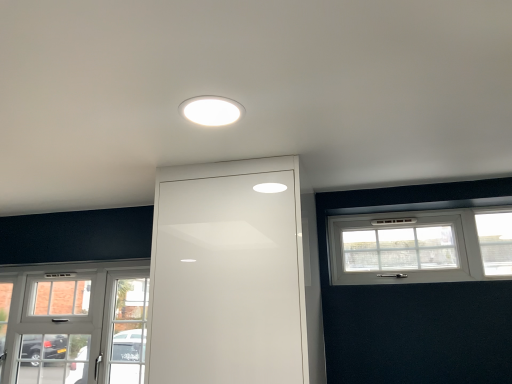
This screenshot has width=512, height=384. I want to click on white glass door at lower left, which is counted as the 1th window, starting from the back, so click(x=74, y=323).

What do you see at coordinates (421, 246) in the screenshot? I see `white textured window at upper right, marked as the 2th window in a left-to-right arrangement` at bounding box center [421, 246].

What do you see at coordinates (228, 275) in the screenshot? I see `white glossy door at center` at bounding box center [228, 275].

In order to face white glossy door at center, should I rotate leftwards or rightwards?

Turn left by 1.348 degrees to look at white glossy door at center.

The height and width of the screenshot is (384, 512). Find the location of `white glass door at lower left, which is counted as the 1th window, starting from the back`. white glass door at lower left, which is counted as the 1th window, starting from the back is located at coordinates (74, 323).

Would you say white glass door at lower left, placed as the first window when sorted from left to right, contains white glossy light fixture at center?

No, white glossy light fixture at center is not surrounded by white glass door at lower left, placed as the first window when sorted from left to right.

Consider the image. Is white glass door at lower left, which is counted as the 1th window, starting from the back, facing towards white glossy light fixture at center?

No, white glass door at lower left, which is counted as the 1th window, starting from the back, is not aimed at white glossy light fixture at center.

From a real-world perspective, is white glass door at lower left, acting as the 2th window starting from the front, physically located above or below white glossy light fixture at center?

In terms of real-world spatial position, white glass door at lower left, acting as the 2th window starting from the front, is below white glossy light fixture at center.

From their relative heights in the image, would you say white glossy door at center is taller or shorter than white glass door at lower left, placed as the first window when sorted from left to right?

Considering their sizes, white glossy door at center has more height than white glass door at lower left, placed as the first window when sorted from left to right.

In terms of size, does white glossy door at center appear bigger or smaller than white glass door at lower left, marked as the 1th window in a bottom-to-top arrangement?

white glossy door at center is bigger than white glass door at lower left, marked as the 1th window in a bottom-to-top arrangement.

Does point (164, 185) come behind point (71, 303)?

That is False.

From the picture: How distant is white glossy door at center from white glass door at lower left, acting as the 2th window starting from the front?

white glossy door at center and white glass door at lower left, acting as the 2th window starting from the front, are 3.67 feet apart.

Is point (207, 99) closer or farther from the camera than point (483, 270)?

Point (207, 99) is positioned closer to the camera compared to point (483, 270).

Does white glossy light fixture at center have a greater height compared to white textured window at upper right, the second window in the bottom-to-top sequence?

Incorrect, the height of white glossy light fixture at center is not larger of that of white textured window at upper right, the second window in the bottom-to-top sequence.

Consider the image. Is white glossy light fixture at center bigger than white textured window at upper right, marked as the 2th window in a left-to-right arrangement?

No, white glossy light fixture at center is not bigger than white textured window at upper right, marked as the 2th window in a left-to-right arrangement.

From a real-world perspective, which object stands above the other?

white glossy light fixture at center, from a real-world perspective.

Measure the distance between white glossy light fixture at center and white glass door at lower left, placed as the first window when sorted from left to right.

white glossy light fixture at center and white glass door at lower left, placed as the first window when sorted from left to right, are 5.91 feet apart.

Is white glossy light fixture at center turned away from white glass door at lower left, marked as the 1th window in a bottom-to-top arrangement?

No.

Between white glossy light fixture at center and white glass door at lower left, which is the 2th window from top to bottom, which one appears on the left side from the viewer's perspective?

From the viewer's perspective, white glass door at lower left, which is the 2th window from top to bottom, appears more on the left side.

Is white glossy light fixture at center surrounding white glass door at lower left, acting as the 2th window starting from the front?

That's incorrect, white glass door at lower left, acting as the 2th window starting from the front, is not inside white glossy light fixture at center.

Does white textured window at upper right, which ranks as the first window in right-to-left order, appear on the left side of white glossy door at center?

No, white textured window at upper right, which ranks as the first window in right-to-left order, is not to the left of white glossy door at center.

Is white textured window at upper right, placed as the 1th window when sorted from front to back, further to camera compared to white glossy door at center?

Yes, white textured window at upper right, placed as the 1th window when sorted from front to back, is further from the viewer.

Does point (488, 236) come closer to viewer compared to point (180, 295)?

No, (488, 236) is further to viewer.

In terms of size, does white glass door at lower left, which is counted as the 1th window, starting from the back, appear bigger or smaller than white glossy door at center?

In the image, white glass door at lower left, which is counted as the 1th window, starting from the back, appears to be smaller than white glossy door at center.

Would you say white glass door at lower left, which is the 2th window from top to bottom, contains white glossy door at center?

No, white glass door at lower left, which is the 2th window from top to bottom, does not contain white glossy door at center.

Between white glass door at lower left, marked as the 1th window in a bottom-to-top arrangement, and white glossy door at center, which one has less height?

With less height is white glass door at lower left, marked as the 1th window in a bottom-to-top arrangement.

Is white glass door at lower left, placed as the first window when sorted from left to right, in front of or behind white glossy door at center in the image?

white glass door at lower left, placed as the first window when sorted from left to right, is behind white glossy door at center.

Would you say white textured window at upper right, placed as the 1th window when sorted from front to back, is inside or outside white glossy light fixture at center?

white textured window at upper right, placed as the 1th window when sorted from front to back, lies outside white glossy light fixture at center.

Can you confirm if white textured window at upper right, positioned as the 1th window in top-to-bottom order, is bigger than white glossy light fixture at center?

Yes, white textured window at upper right, positioned as the 1th window in top-to-bottom order, is bigger than white glossy light fixture at center.

Which is closer, (329, 253) or (217, 103)?

The point (217, 103) is in front.

Considering the relative sizes of white textured window at upper right, placed as the 1th window when sorted from front to back, and white glossy light fixture at center in the image provided, is white textured window at upper right, placed as the 1th window when sorted from front to back, taller than white glossy light fixture at center?

Yes, white textured window at upper right, placed as the 1th window when sorted from front to back, is taller than white glossy light fixture at center.

This screenshot has width=512, height=384. I want to click on lighting above the white glass door at lower left, which is counted as the 1th window, starting from the back (from the image's perspective), so click(x=211, y=110).

The height and width of the screenshot is (384, 512). Find the location of `door in front of the white glass door at lower left, marked as the 1th window in a bottom-to-top arrangement`. door in front of the white glass door at lower left, marked as the 1th window in a bottom-to-top arrangement is located at coordinates (228, 275).

Considering their positions, is white glass door at lower left, which is the 2th window from top to bottom, positioned closer to white glossy light fixture at center than white textured window at upper right, arranged as the second window when viewed from the back?

white textured window at upper right, arranged as the second window when viewed from the back, is positioned closer to the anchor white glossy light fixture at center.

Estimate the real-world distances between objects in this image. Which object is closer to white glass door at lower left, which is counted as the 1th window, starting from the back, white glossy light fixture at center or white glossy door at center?

white glossy door at center.

When comparing their distances from white glossy door at center, does white glossy light fixture at center or white textured window at upper right, positioned as the 1th window in top-to-bottom order, seem closer?

Among the two, white glossy light fixture at center is located nearer to white glossy door at center.

Estimate the real-world distances between objects in this image. Which object is further from white glossy light fixture at center, white glossy door at center or white textured window at upper right, which ranks as the first window in right-to-left order?

Among the two, white textured window at upper right, which ranks as the first window in right-to-left order, is located further to white glossy light fixture at center.

Looking at the image, which one is located further to white glossy door at center, white glass door at lower left, marked as the 1th window in a bottom-to-top arrangement, or white glossy light fixture at center?

white glass door at lower left, marked as the 1th window in a bottom-to-top arrangement.

Based on their spatial positions, is white glossy door at center or white glass door at lower left, marked as the 1th window in a bottom-to-top arrangement, closer to white textured window at upper right, which ranks as the first window in right-to-left order?

Among the two, white glossy door at center is located nearer to white textured window at upper right, which ranks as the first window in right-to-left order.

Estimate the real-world distances between objects in this image. Which object is further from white glass door at lower left, arranged as the second window when viewed from the right, white glossy light fixture at center or white textured window at upper right, the second window in the bottom-to-top sequence?

Based on the image, white glossy light fixture at center appears to be further to white glass door at lower left, arranged as the second window when viewed from the right.

Considering their positions, is white textured window at upper right, the second window in the bottom-to-top sequence, positioned closer to white glossy door at center than white glass door at lower left, arranged as the second window when viewed from the right?

white textured window at upper right, the second window in the bottom-to-top sequence, is closer to white glossy door at center.

You are a GUI agent. You are given a task and a screenshot of the screen. Output one action in this format:
    pyautogui.click(x=<x>, y=<y>)
    Task: Click on the lighting between white glass door at lower left, arranged as the second window when viewed from the right, and white textured window at upper right, the second window in the bottom-to-top sequence, in the horizontal direction
    This screenshot has height=384, width=512.
    Given the screenshot: What is the action you would take?
    pyautogui.click(x=211, y=110)

Locate an element on the screen. door between white glass door at lower left, placed as the first window when sorted from left to right, and white textured window at upper right, placed as the 1th window when sorted from front to back, from left to right is located at coordinates (228, 275).

Identify the location of lighting between white glass door at lower left, which is the 2th window from top to bottom, and white glossy door at center. (211, 110).

You are a GUI agent. You are given a task and a screenshot of the screen. Output one action in this format:
    pyautogui.click(x=<x>, y=<y>)
    Task: Click on the door located between white glossy light fixture at center and white textured window at upper right, positioned as the 1th window in top-to-bottom order, in the left-right direction
    The width and height of the screenshot is (512, 384).
    Given the screenshot: What is the action you would take?
    pyautogui.click(x=228, y=275)